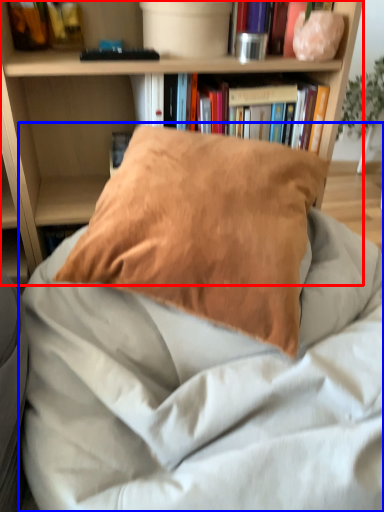
Question: Which object appears farthest to the camera in this image, bookcase (highlighted by a red box) or bed (highlighted by a blue box)?

Choices:
 (A) bookcase
 (B) bed

Answer: (A)